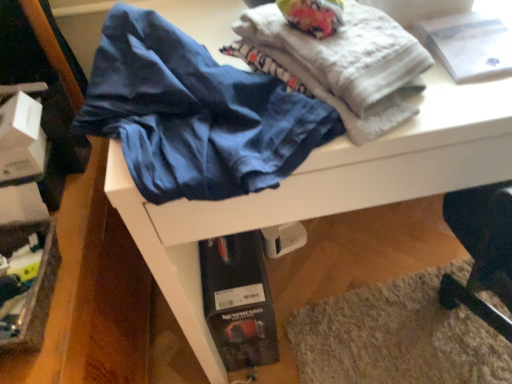
You are a GUI agent. You are given a task and a screenshot of the screen. Output one action in this format:
    pyautogui.click(x=<x>, y=<y>)
    Task: Click on the free space to the right of white textured towel at upper center
    This screenshot has width=512, height=384.
    Given the screenshot: What is the action you would take?
    pyautogui.click(x=472, y=75)